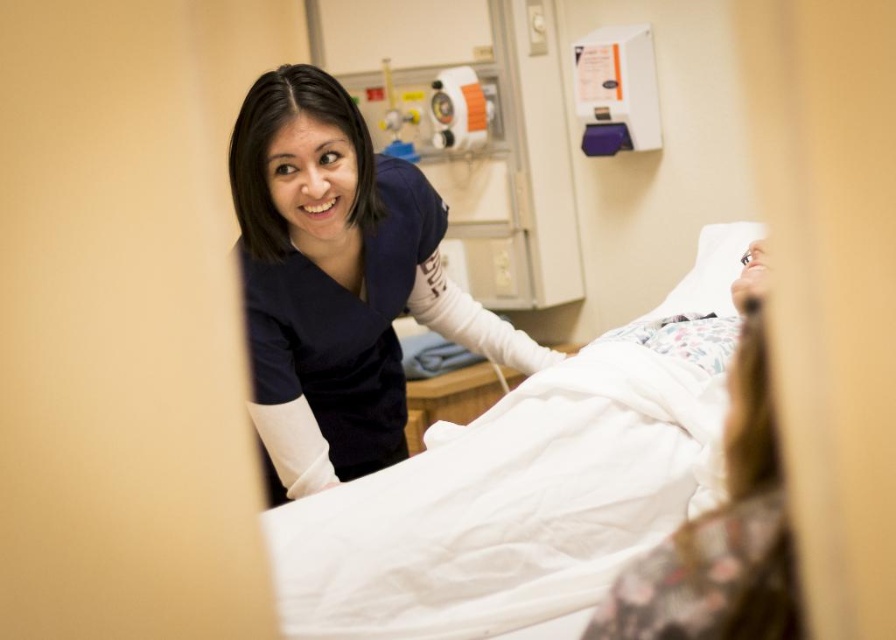
Question: Can you confirm if white smooth bed at center is positioned below white fabric at right?

Choices:
 (A) yes
 (B) no

Answer: (A)

Question: Can you confirm if white smooth bed at center is positioned to the left of navy blue scrubs at upper center?

Choices:
 (A) no
 (B) yes

Answer: (A)

Question: Which object is positioned closest to the white smooth bed at center?

Choices:
 (A) navy blue scrubs at upper center
 (B) white fabric at right

Answer: (A)

Question: Estimate the real-world distances between objects in this image. Which object is farther from the white smooth bed at center?

Choices:
 (A) white fabric at right
 (B) navy blue scrubs at upper center

Answer: (A)

Question: Is white smooth bed at center to the left of white fabric at right from the viewer's perspective?

Choices:
 (A) no
 (B) yes

Answer: (A)

Question: Which of the following is the closest to the observer?

Choices:
 (A) navy blue scrubs at upper center
 (B) white fabric at right
 (C) white smooth bed at center

Answer: (B)